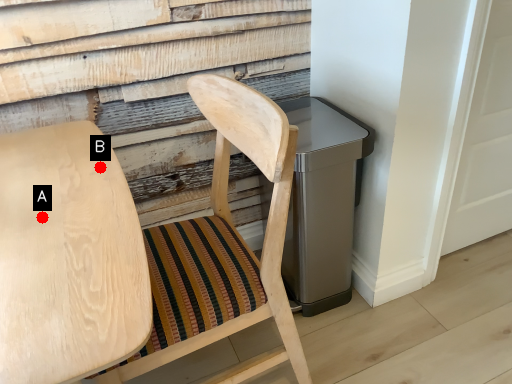
Question: Two points are circled on the image, labeled by A and B beside each circle. Among these points, which one is nearest to the camera?

Choices:
 (A) A is closer
 (B) B is closer

Answer: (A)